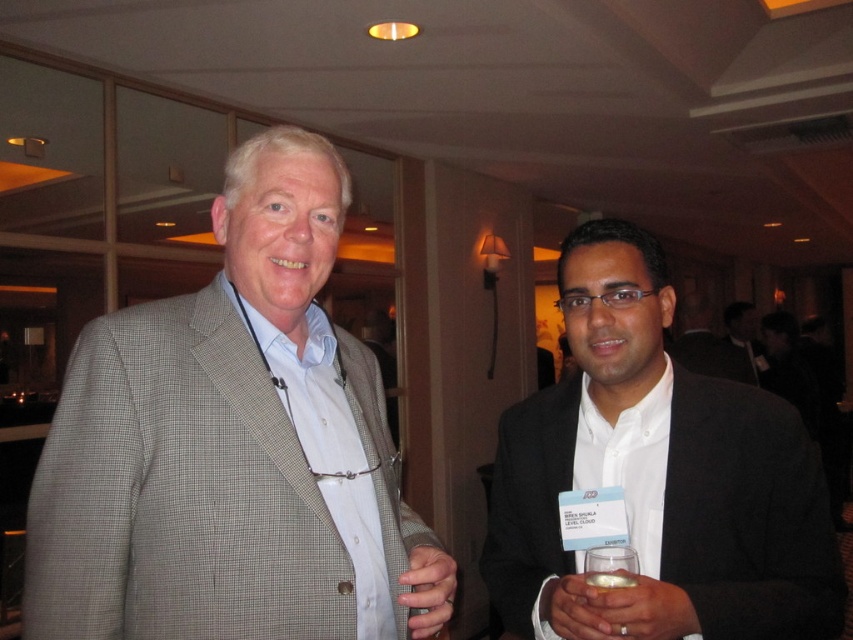
Based on the coordinates provided, which object is located at point (428, 589) in the image?

The point (428, 589) corresponds to the matte gray suit at center.

You are standing in the room and want to move from point A to point B. Point A is located at coordinates point (236,532) and point B is at point (724,336). Which point is closer to you when you first enter the room?

Point (236,532) is closer to the viewer than point (724,336), so you would first encounter point A when entering the room.